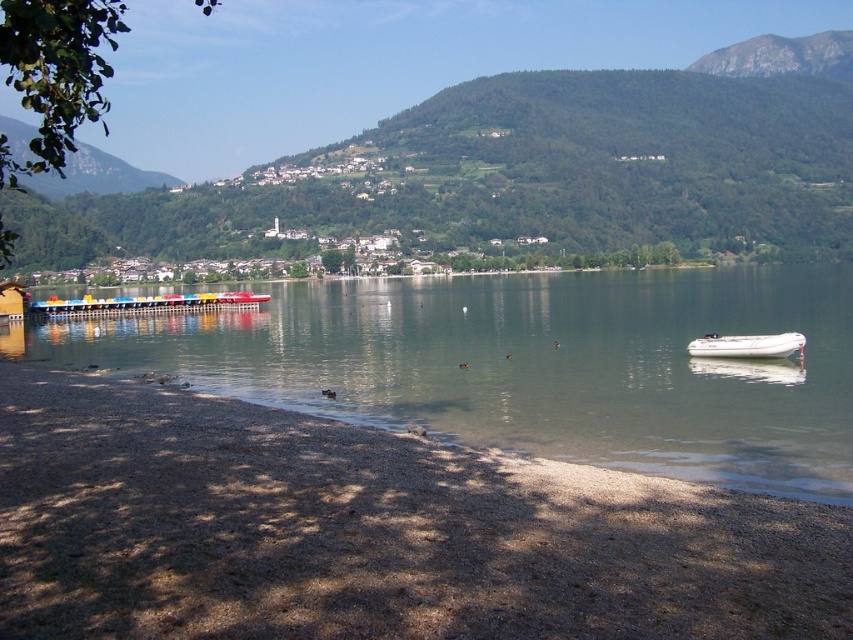
How far apart are brown gravelly sand at lower left and white rubber boat at lower right?

The distance of brown gravelly sand at lower left from white rubber boat at lower right is 31.55 meters.

Can you confirm if brown gravelly sand at lower left is smaller than white rubber boat at lower right?

No.

Does point (506, 545) come behind point (753, 336)?

That is False.

Locate an element on the screen. Image resolution: width=853 pixels, height=640 pixels. brown gravelly sand at lower left is located at coordinates (370, 532).

Does point (770, 426) come in front of point (776, 340)?

Yes.

Is clear water at lower left further to the viewer compared to white rubber boat at lower right?

That is False.

Does point (491, 369) come closer to viewer compared to point (749, 355)?

No.

Locate an element on the screen. Image resolution: width=853 pixels, height=640 pixels. clear water at lower left is located at coordinates (532, 364).

Is point (543, 461) closer to camera compared to point (618, 417)?

Yes, it is.

Does brown gravelly sand at lower left have a lesser width compared to clear water at lower left?

Indeed, brown gravelly sand at lower left has a lesser width compared to clear water at lower left.

Which is in front, point (253, 468) or point (820, 449)?

Point (253, 468)

You are a GUI agent. You are given a task and a screenshot of the screen. Output one action in this format:
    pyautogui.click(x=<x>, y=<y>)
    Task: Click on the brown gravelly sand at lower left
    
    Given the screenshot: What is the action you would take?
    pyautogui.click(x=370, y=532)